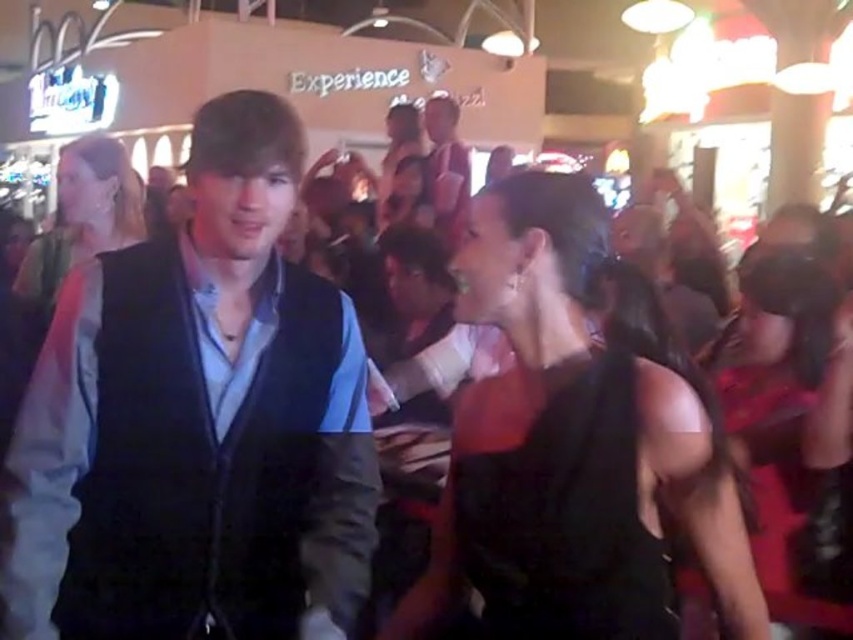
What is the exact 2D coordinate of the black satin dress at center?

The black satin dress at center is located at the point with coordinates 0.686 in the x direction and 0.675 in the y direction.

You are a photographer standing 3 meters away from the matte black vest at center. You want to take a photo of the black satin dress at lower right without moving your position. Is the dress within your camera lens range if your camera can focus up to 3.5 meters?

The distance between the black satin dress at lower right and the matte black vest at center is 2.75 meters. Since you are 3 meters away from the vest, the total distance to the dress would be 3 meters plus 2.75 meters, totaling 5.75 meters. This exceeds the camera lens range of 3.5 meters, so the dress is out of focus.

You are a photographer standing at the center of the room. You need to take a photo that includes both the black satin dress at lower right and the matte black dress at center. Given that your camera has a maximum focus range of 10 feet, will you be able to capture both dresses in focus without moving?

The distance between the black satin dress at lower right and the matte black dress at center is 9.73 feet, which is within the camera maximum focus range of 10 feet. Therefore, you can capture both dresses in focus without moving.